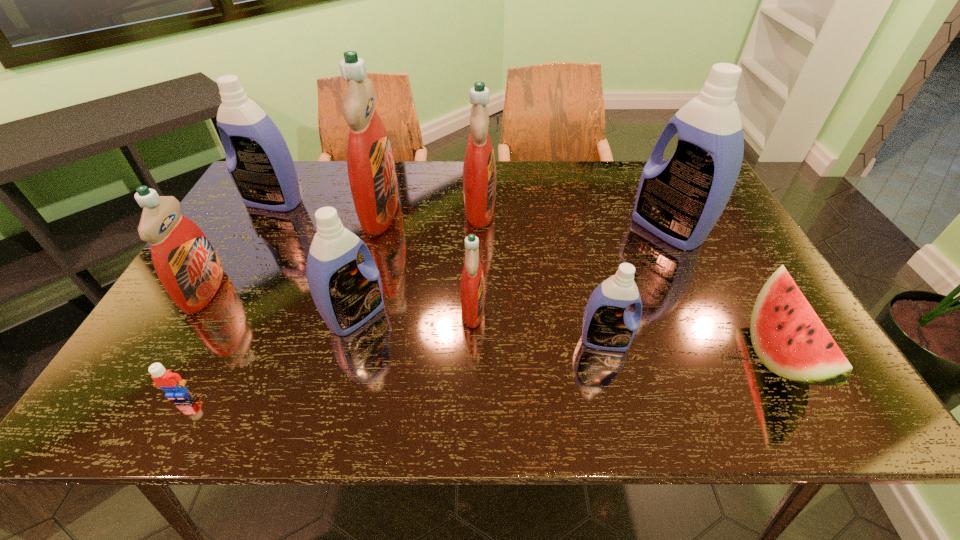
Image resolution: width=960 pixels, height=540 pixels. Find the location of `vacant area between the green watermelon and the Lego`. vacant area between the green watermelon and the Lego is located at coordinates (477, 373).

Find the location of a particular element. The image size is (960, 540). unoccupied position between the second biggest red detergent and the rightmost blue detergent is located at coordinates (574, 219).

Locate an element on the screen. Image resolution: width=960 pixels, height=540 pixels. empty space between the third smallest red detergent and the rightmost blue detergent is located at coordinates (574, 219).

Where is `object that is the eighth closest to the smallest blue detergent`? This screenshot has width=960, height=540. object that is the eighth closest to the smallest blue detergent is located at coordinates (188, 267).

Find the location of a particular element. object that ranks as the seventh closest to the smallest red detergent is located at coordinates (788, 337).

Point out which detergent is positioned as the fourth nearest to the white Lego. Please provide its 2D coordinates. Your answer should be formatted as a tuple, i.e. [(x, y)], where the tuple contains the x and y coordinates of a point satisfying the conditions above.

[(472, 285)]

Find the location of a particular element. detergent that is the second closest one to the smallest red detergent is located at coordinates (607, 325).

Point out which red detergent is positioned as the fourth nearest to the shortest object. Please provide its 2D coordinates. Your answer should be formatted as a tuple, i.e. [(x, y)], where the tuple contains the x and y coordinates of a point satisfying the conditions above.

[(479, 170)]

Point out which red detergent is positioned as the second nearest to the green watermelon. Please provide its 2D coordinates. Your answer should be formatted as a tuple, i.e. [(x, y)], where the tuple contains the x and y coordinates of a point satisfying the conditions above.

[(479, 170)]

In order to click on blue detergent that is the third closest to the third red detergent from right to left in this screenshot , I will do `click(607, 325)`.